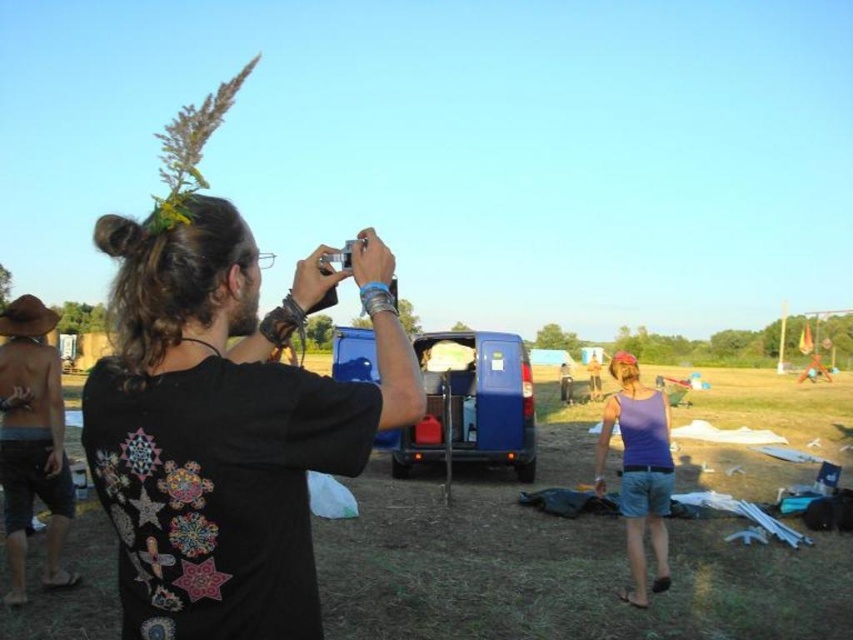
You are standing in the outdoor gathering scene and want to pick up the brown straw hat at left and the purple cotton tank top at lower right. Which item can you reach first without moving your position?

The brown straw hat at left is closer to the viewer than the purple cotton tank top at lower right, so you can reach the brown straw hat at left first without moving your position.

You are standing in the outdoor gathering scene and want to pick up the brown straw hat at left. Where exactly should you look to find it?

The brown straw hat at left is located at point 0.691 on the x axis and 0.039 on the y axis.